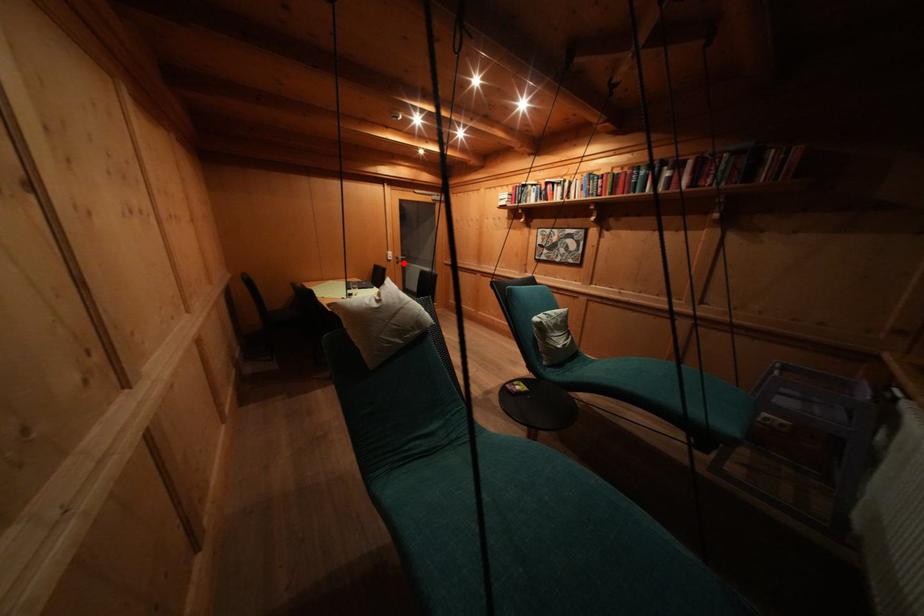
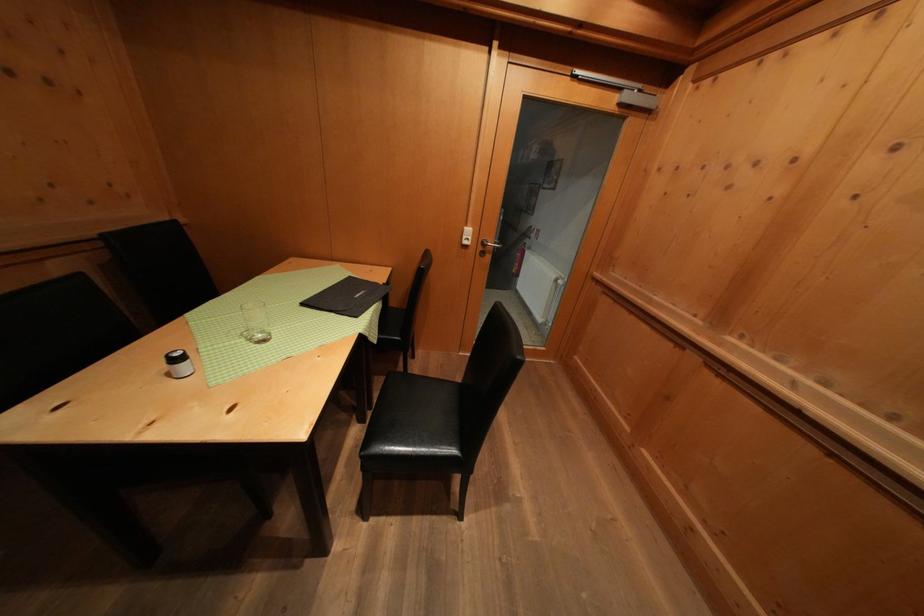
Question: I am providing you with two images of the same scene from different viewpoints. A red point is marked on the first image. At the location where the point appears in image 1, is it still visible in image 2?

Choices:
 (A) Yes
 (B) No

Answer: (A)